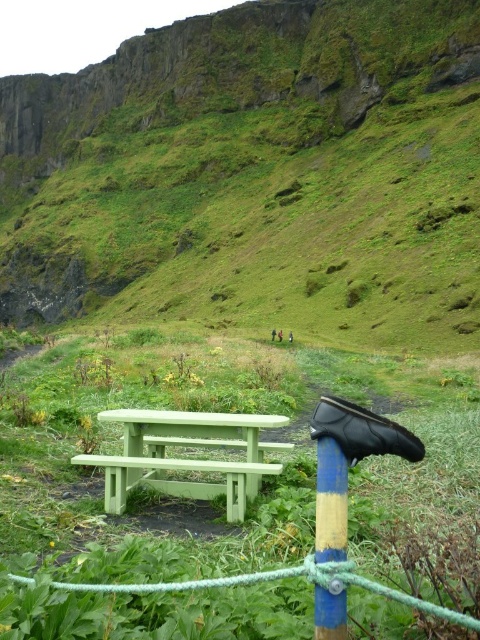
Question: In this image, where is green grassy hillside at center located relative to blue painted wood pole at center?

Choices:
 (A) left
 (B) right

Answer: (A)

Question: Which point is closer to the camera?

Choices:
 (A) (450, 337)
 (B) (328, 502)

Answer: (B)

Question: Which of the following is the farthest from the observer?

Choices:
 (A) green painted wood bench at center
 (B) green grassy hillside at center
 (C) blue painted wood pole at center

Answer: (B)

Question: Is green grassy hillside at center below blue painted wood pole at center?

Choices:
 (A) no
 (B) yes

Answer: (A)

Question: Can you confirm if green painted wood bench at center is positioned to the left of blue painted wood pole at center?

Choices:
 (A) yes
 (B) no

Answer: (A)

Question: Based on their relative distances, which object is nearer to the green grassy hillside at center?

Choices:
 (A) blue painted wood pole at center
 (B) green painted wood bench at center

Answer: (A)